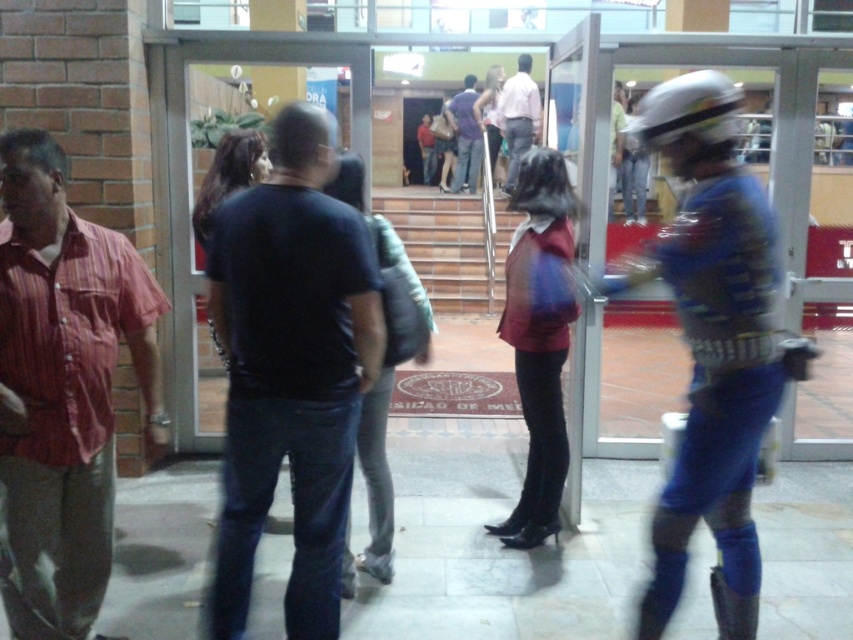
Question: Is blue metallic armor at center to the left of transparent glass door at center from the viewer's perspective?

Choices:
 (A) yes
 (B) no

Answer: (B)

Question: Which point is closer to the camera taking this photo?

Choices:
 (A) (91, 388)
 (B) (764, 412)
 (C) (257, 384)

Answer: (B)

Question: Observing the image, what is the correct spatial positioning of striped cotton shirt at left in reference to matte purple shirt at center?

Choices:
 (A) left
 (B) right

Answer: (A)

Question: Which object is the closest to the blue metallic armor at center?

Choices:
 (A) matte pink shirt at center
 (B) transparent glass door at center
 (C) striped cotton shirt at left
 (D) matte purple shirt at center

Answer: (C)

Question: Which of the following is the farthest from the observer?

Choices:
 (A) tap(753, 317)
 (B) tap(526, 141)
 (C) tap(155, 204)

Answer: (B)

Question: Is dark blue shirt at center bigger than striped cotton shirt at left?

Choices:
 (A) yes
 (B) no

Answer: (B)